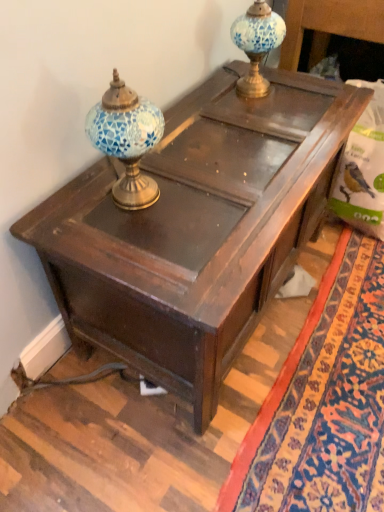
The height and width of the screenshot is (512, 384). I want to click on vacant area that lies to the right of blue mosaic glass lamp at upper left, which is counted as the 2th candle holder, starting from the right, so click(209, 189).